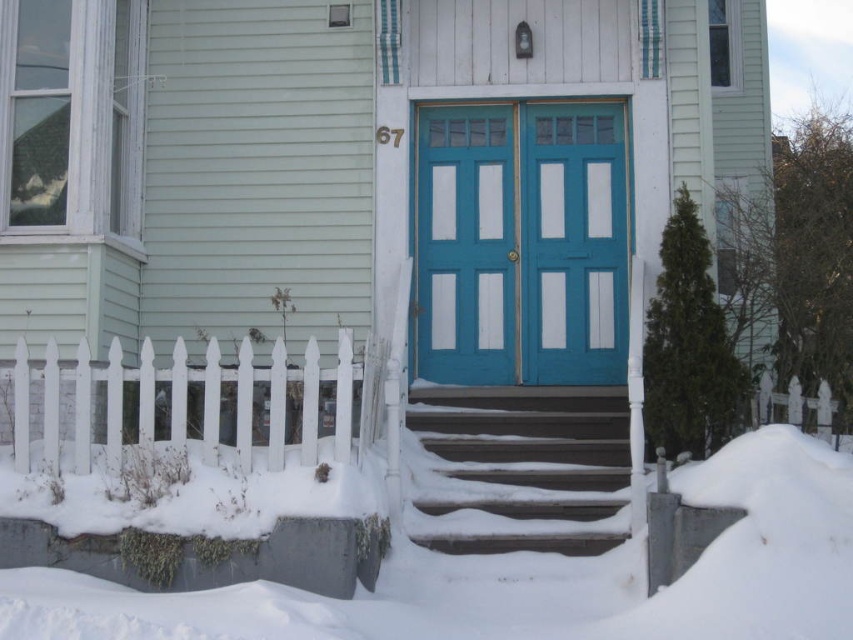
Question: Considering the real-world distances, which object is closest to the teal painted wood door at center?

Choices:
 (A) white fluffy snow at lower center
 (B) smooth gray stairs at center

Answer: (B)

Question: Which object is positioned farthest from the smooth gray stairs at center?

Choices:
 (A) white fluffy snow at lower center
 (B) teal painted wood door at center

Answer: (B)

Question: Is teal painted wood door at center wider than smooth gray stairs at center?

Choices:
 (A) no
 (B) yes

Answer: (B)

Question: Does teal painted wood door at center lie in front of smooth gray stairs at center?

Choices:
 (A) no
 (B) yes

Answer: (A)

Question: Which of these objects is positioned closest to the smooth gray stairs at center?

Choices:
 (A) teal painted wood door at center
 (B) white fluffy snow at lower center

Answer: (B)

Question: Is white fluffy snow at lower center closer to the viewer compared to teal painted wood door at center?

Choices:
 (A) no
 (B) yes

Answer: (B)